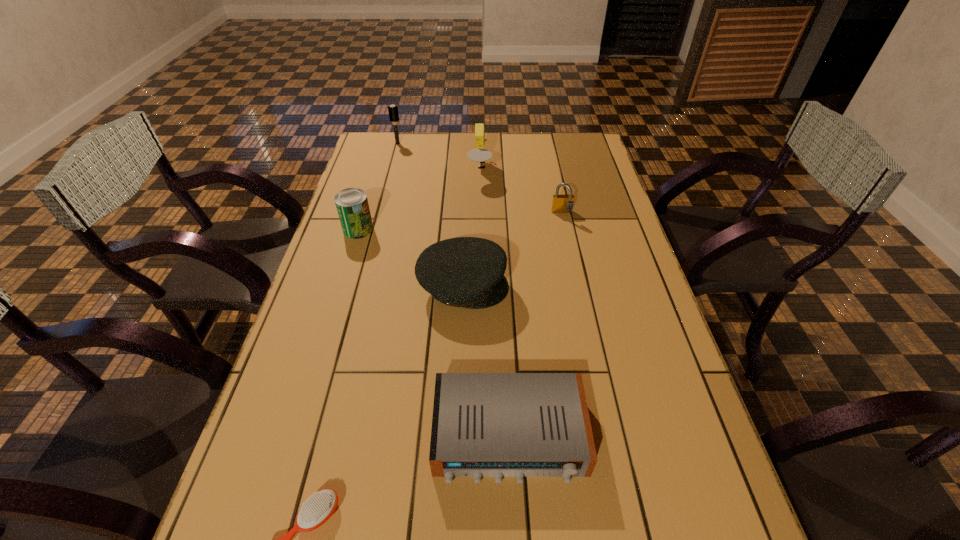
Where is `empty location between the can and the taller hairbrush`? Image resolution: width=960 pixels, height=540 pixels. empty location between the can and the taller hairbrush is located at coordinates (378, 186).

Locate which object ranks sixth in proximity to the second shortest object. Please provide its 2D coordinates. Your answer should be formatted as a tuple, i.e. [(x, y)], where the tuple contains the x and y coordinates of a point satisfying the conditions above.

[(393, 112)]

Identify the location of object that is the fifth closest to the can. (498, 425).

Image resolution: width=960 pixels, height=540 pixels. I want to click on free point that satisfies the following two spatial constraints: 1. on the front-facing side of the sponge; 2. on the front side of the can, so click(479, 229).